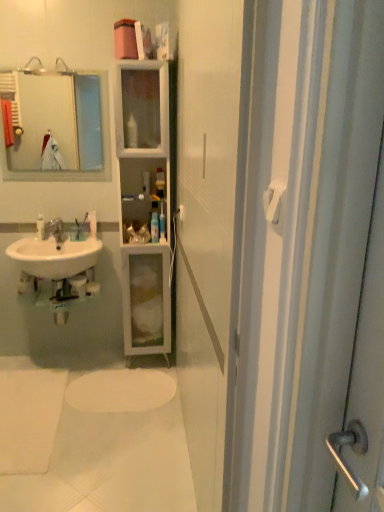
Question: Are white plastic towel bar at upper right and white glossy toothbrush at left, the 1th toiletry in the left-to-right sequence, beside each other?

Choices:
 (A) no
 (B) yes

Answer: (A)

Question: Does white plastic towel bar at upper right have a lesser width compared to white glossy toothbrush at left, acting as the fourth toiletry starting from the right?

Choices:
 (A) no
 (B) yes

Answer: (B)

Question: From the image's perspective, is white plastic towel bar at upper right beneath white glossy toothbrush at left, acting as the fourth toiletry starting from the right?

Choices:
 (A) yes
 (B) no

Answer: (A)

Question: Is white glossy toothbrush at left, acting as the fourth toiletry starting from the right, completely or partially inside white plastic towel bar at upper right?

Choices:
 (A) no
 (B) yes

Answer: (A)

Question: Is white plastic towel bar at upper right at the left side of white glossy toothbrush at left, acting as the fourth toiletry starting from the right?

Choices:
 (A) no
 (B) yes

Answer: (A)

Question: Do you think white plastic bottle at center, which appears as the third toiletry when viewed from the left, is within clear plastic toothbrush at center, the second toiletry from the left, or outside of it?

Choices:
 (A) inside
 (B) outside

Answer: (B)

Question: From the image's perspective, is white plastic bottle at center, which appears as the third toiletry when viewed from the left, located above or below clear plastic toothbrush at center, the second toiletry from the left?

Choices:
 (A) below
 (B) above

Answer: (A)

Question: Relative to clear plastic toothbrush at center, the second toiletry from the left, is white plastic bottle at center, which appears as the 2th toiletry when viewed from the right, in front or behind?

Choices:
 (A) behind
 (B) front

Answer: (B)

Question: Visually, is white plastic bottle at center, which appears as the 2th toiletry when viewed from the right, positioned to the left or to the right of clear plastic toothbrush at center, which is the third toiletry in right-to-left order?

Choices:
 (A) right
 (B) left

Answer: (A)

Question: Visually, is white plastic towel bar at upper right positioned to the left or to the right of translucent plastic bottle at center, the 4th toiletry viewed from the left?

Choices:
 (A) left
 (B) right

Answer: (B)

Question: From the image's perspective, relative to translucent plastic bottle at center, the 4th toiletry viewed from the left, is white plastic towel bar at upper right above or below?

Choices:
 (A) below
 (B) above

Answer: (A)

Question: Considering the positions of point (283, 189) and point (162, 234), is point (283, 189) closer or farther from the camera than point (162, 234)?

Choices:
 (A) closer
 (B) farther

Answer: (A)

Question: Considering the positions of white plastic towel bar at upper right and translucent plastic bottle at center, which appears as the first toiletry when viewed from the right, in the image, is white plastic towel bar at upper right bigger or smaller than translucent plastic bottle at center, which appears as the first toiletry when viewed from the right,?

Choices:
 (A) big
 (B) small

Answer: (B)

Question: Considering the positions of white plastic bottle at center, which appears as the third toiletry when viewed from the left, and white glossy cabinet at center in the image, is white plastic bottle at center, which appears as the third toiletry when viewed from the left, wider or thinner than white glossy cabinet at center?

Choices:
 (A) wide
 (B) thin

Answer: (B)

Question: From a real-world perspective, is white plastic bottle at center, which appears as the third toiletry when viewed from the left, above or below white glossy cabinet at center?

Choices:
 (A) below
 (B) above

Answer: (B)